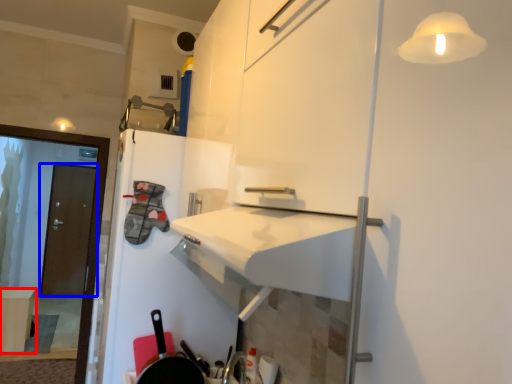
Question: Which point is closer to the camera, table (highlighted by a red box) or door (highlighted by a blue box)?

Choices:
 (A) table
 (B) door

Answer: (A)